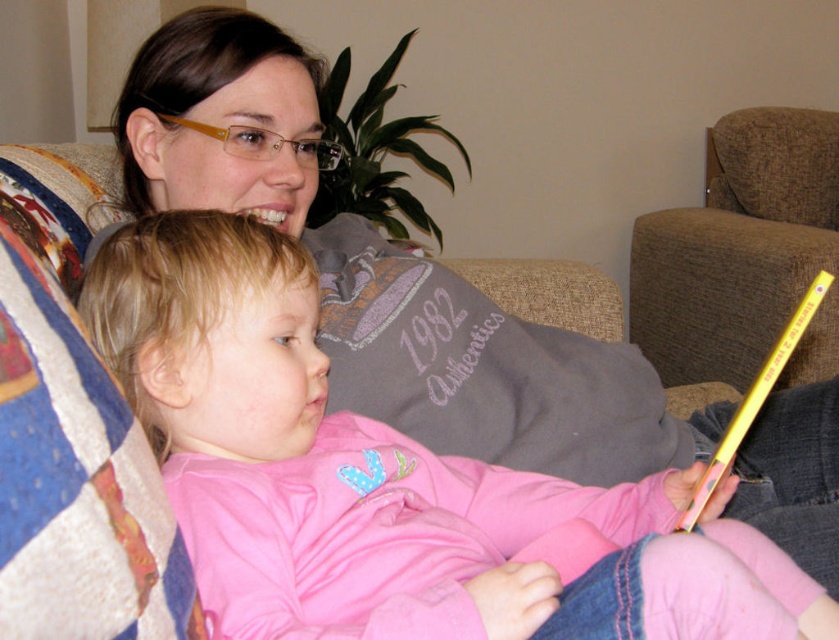
Question: Which of the following is the closest to the observer?

Choices:
 (A) click(x=730, y=314)
 (B) click(x=473, y=552)

Answer: (B)

Question: Is pink fleece sweater at center to the left of brown fabric armchair at upper right from the viewer's perspective?

Choices:
 (A) no
 (B) yes

Answer: (B)

Question: Which of the following is the farthest from the observer?

Choices:
 (A) (795, 152)
 (B) (123, 292)

Answer: (A)

Question: Can you confirm if pink fleece sweater at center is positioned above brown fabric armchair at upper right?

Choices:
 (A) yes
 (B) no

Answer: (B)

Question: Does pink fleece sweater at center have a greater width compared to brown fabric armchair at upper right?

Choices:
 (A) no
 (B) yes

Answer: (B)